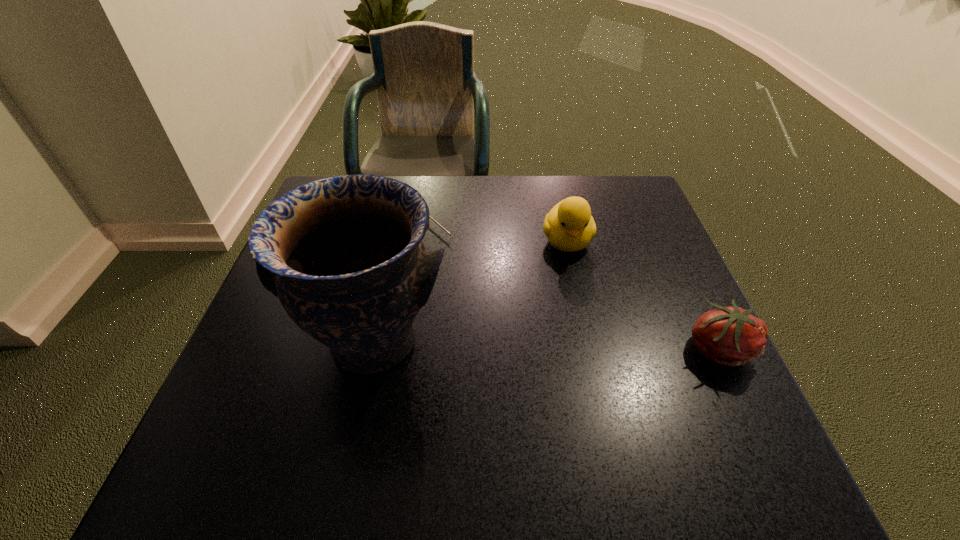
What are the coordinates of `pottery` in the screenshot? It's located at (344, 255).

The width and height of the screenshot is (960, 540). I want to click on the rightmost object, so click(x=731, y=336).

The image size is (960, 540). Identify the location of the second shortest object. (731, 336).

At what (x,y) coordinates should I click in order to perform the action: click on screwdriver. Please return your answer as a coordinate pair (x, y). Looking at the image, I should click on (430, 217).

Image resolution: width=960 pixels, height=540 pixels. Identify the location of the third shortest object. (569, 226).

Locate an element on the screen. the third object from left to right is located at coordinates (569, 226).

I want to click on free region located insert the shortest object into a screw head, so (449, 245).

You are a GUI agent. You are given a task and a screenshot of the screen. Output one action in this format:
    pyautogui.click(x=<x>, y=<y>)
    Task: Click on the vacant space located 0.110m insert the shortest object into a screw head
    Image resolution: width=960 pixels, height=540 pixels.
    Given the screenshot: What is the action you would take?
    pyautogui.click(x=464, y=258)

The image size is (960, 540). Identify the location of free location located 0.060m insert the shortest object into a screw head. (451, 247).

Where is `vacant space located on the front-facing side of the third object from left to right`? The width and height of the screenshot is (960, 540). vacant space located on the front-facing side of the third object from left to right is located at coordinates click(x=595, y=386).